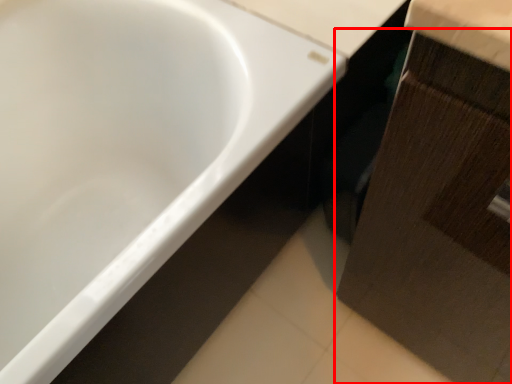
Question: Where is cabinetry (annotated by the red box) located in relation to bathtub in the image?

Choices:
 (A) right
 (B) left

Answer: (A)